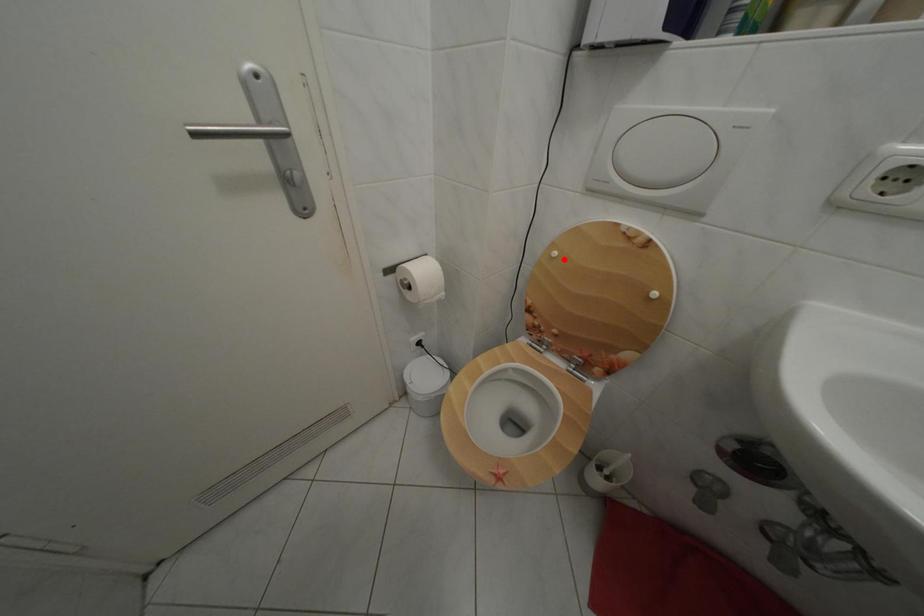
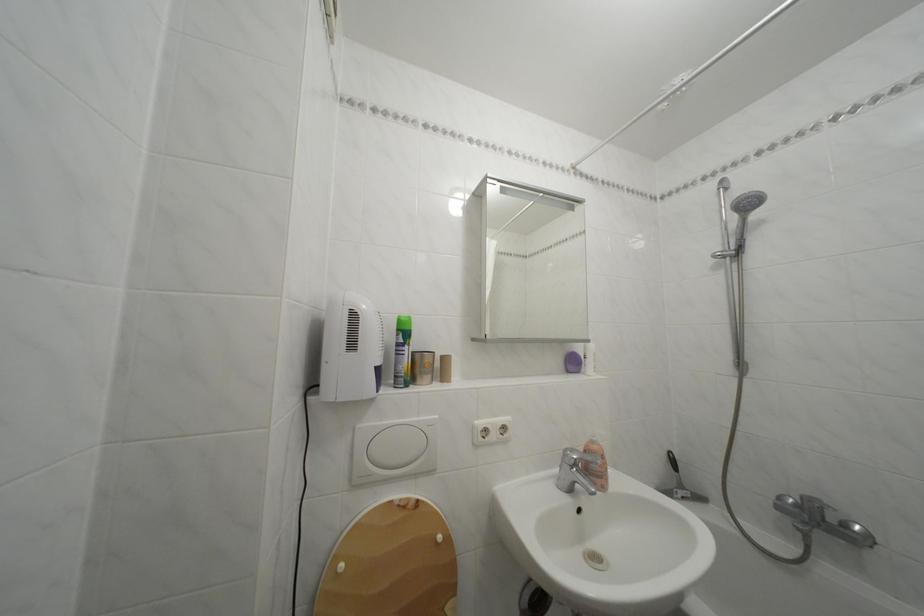
Find the pixel in the second image that matches the highlighted location in the first image.

(350, 573)